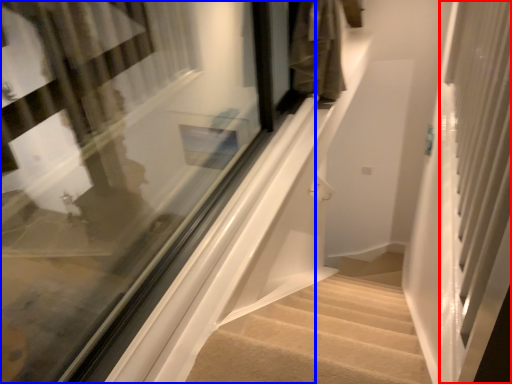
Question: Among these objects, which one is nearest to the camera, screen door (highlighted by a red box) or window (highlighted by a blue box)?

Choices:
 (A) screen door
 (B) window

Answer: (A)